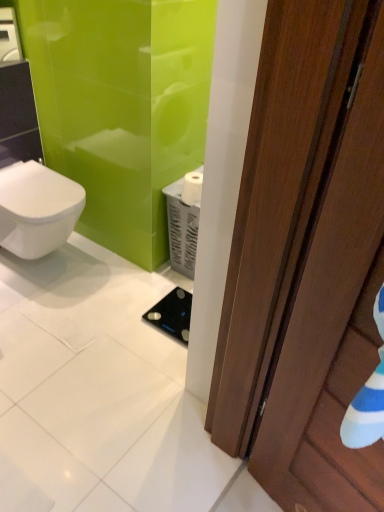
Find the location of a particular element. The width and height of the screenshot is (384, 512). black glass scale at center is located at coordinates (172, 314).

Find the location of a particular element. Image resolution: width=384 pixels, height=512 pixels. white glossy bidet at left is located at coordinates (37, 209).

This screenshot has width=384, height=512. What are the coordinates of `appliance below the brown wooden door at right (from the image's perspective)` in the screenshot? It's located at (172, 314).

Is black glass scale at center at the back of brown wooden door at right?

brown wooden door at right is not turned away from black glass scale at center.

From a real-world perspective, relative to black glass scale at center, is brown wooden door at right vertically above or below?

brown wooden door at right is above black glass scale at center.

Is point (286, 348) positioned after point (186, 313)?

No, it is not.

Does point (29, 223) come in front of point (162, 327)?

That is True.

Identify the location of appliance on the right of white glossy bidet at left. [x=172, y=314].

From their relative heights in the image, would you say white glossy bidet at left is taller or shorter than black glass scale at center?

Considering their sizes, white glossy bidet at left has more height than black glass scale at center.

Can you confirm if white glossy bidet at left is bigger than black glass scale at center?

Correct, white glossy bidet at left is larger in size than black glass scale at center.

Between brown wooden door at right and white glossy bidet at left, which one has less height?

white glossy bidet at left is shorter.

Does brown wooden door at right have a lesser width compared to white glossy bidet at left?

Correct, the width of brown wooden door at right is less than that of white glossy bidet at left.

Is brown wooden door at right looking in the opposite direction of white glossy bidet at left?

No, brown wooden door at right is not facing the opposite direction of white glossy bidet at left.

From the image's perspective, is brown wooden door at right under white glossy bidet at left?

Correct, brown wooden door at right appears lower than white glossy bidet at left in the image.

Where is `toilet paper above the white glossy bidet at left (from a real-world perspective)`? This screenshot has width=384, height=512. toilet paper above the white glossy bidet at left (from a real-world perspective) is located at coordinates (192, 188).

Could you tell me if white glossy bidet at left is turned towards white matte toilet paper at center?

No, white glossy bidet at left is not aimed at white matte toilet paper at center.

Does white glossy bidet at left have a greater height compared to white matte toilet paper at center?

Yes, white glossy bidet at left is taller than white matte toilet paper at center.

How much distance is there between white glossy bidet at left and white matte toilet paper at center?

The distance of white glossy bidet at left from white matte toilet paper at center is 26.72 inches.

Which of these two, white matte toilet paper at center or black glass scale at center, stands taller?

white matte toilet paper at center is taller.

Is white matte toilet paper at center turned away from black glass scale at center?

No, black glass scale at center is not at the back of white matte toilet paper at center.

Identify the location of appliance below the white matte toilet paper at center (from a real-world perspective). The width and height of the screenshot is (384, 512). (172, 314).

Which object is wider, white matte toilet paper at center or black glass scale at center?

With larger width is black glass scale at center.

Considering the relative sizes of white matte toilet paper at center and brown wooden door at right in the image provided, is white matte toilet paper at center thinner than brown wooden door at right?

Yes.

Could you tell me if white matte toilet paper at center is turned towards brown wooden door at right?

No, white matte toilet paper at center is not oriented towards brown wooden door at right.

Is white matte toilet paper at center not inside brown wooden door at right?

Yes, white matte toilet paper at center is located beyond the bounds of brown wooden door at right.

Can you confirm if white matte toilet paper at center is bigger than brown wooden door at right?

No.

Is white matte toilet paper at center in front of or behind white glossy bidet at left in the image?

white matte toilet paper at center is behind white glossy bidet at left.

The height and width of the screenshot is (512, 384). Identify the location of toilet paper on the right of white glossy bidet at left. (192, 188).

Considering the relative sizes of white matte toilet paper at center and white glossy bidet at left in the image provided, is white matte toilet paper at center wider than white glossy bidet at left?

Incorrect, the width of white matte toilet paper at center does not surpass that of white glossy bidet at left.

Does white matte toilet paper at center contain white glossy bidet at left?

No, white glossy bidet at left is located outside of white matte toilet paper at center.

Image resolution: width=384 pixels, height=512 pixels. Identify the location of door above the black glass scale at center (from the image's perspective). (332, 308).

What are the coordinates of `appliance below the white glossy bidet at left (from the image's perspective)` in the screenshot? It's located at (172, 314).

From the image, which object appears to be nearer to white glossy bidet at left, brown wooden door at right or black glass scale at center?

Among the two, black glass scale at center is located nearer to white glossy bidet at left.

When comparing their distances from white matte toilet paper at center, does white glossy bidet at left or black glass scale at center seem closer?

black glass scale at center lies closer to white matte toilet paper at center than the other object.

Estimate the real-world distances between objects in this image. Which object is closer to black glass scale at center, brown wooden door at right or white glossy bidet at left?

white glossy bidet at left.

Looking at the image, which one is located further to white matte toilet paper at center, white glossy bidet at left or brown wooden door at right?

brown wooden door at right is further to white matte toilet paper at center.

Looking at the image, which one is located closer to black glass scale at center, white matte toilet paper at center or brown wooden door at right?

Based on the image, white matte toilet paper at center appears to be nearer to black glass scale at center.

Considering their positions, is black glass scale at center positioned further to brown wooden door at right than white glossy bidet at left?

Among the two, white glossy bidet at left is located further to brown wooden door at right.

Considering their positions, is brown wooden door at right positioned further to black glass scale at center than white matte toilet paper at center?

brown wooden door at right lies further to black glass scale at center than the other object.

When comparing their distances from white glossy bidet at left, does black glass scale at center or white matte toilet paper at center seem closer?

white matte toilet paper at center is positioned closer to the anchor white glossy bidet at left.

Where is `toilet paper positioned between brown wooden door at right and black glass scale at center from near to far`? toilet paper positioned between brown wooden door at right and black glass scale at center from near to far is located at coordinates (192, 188).

What are the coordinates of `appliance between white glossy bidet at left and white matte toilet paper at center in the horizontal direction` in the screenshot? It's located at (172, 314).

Locate an element on the screen. The height and width of the screenshot is (512, 384). bidet between brown wooden door at right and black glass scale at center along the z-axis is located at coordinates (37, 209).

Find the location of `bidet between brown wooden door at right and white matte toilet paper at center from front to back`. bidet between brown wooden door at right and white matte toilet paper at center from front to back is located at coordinates (x=37, y=209).